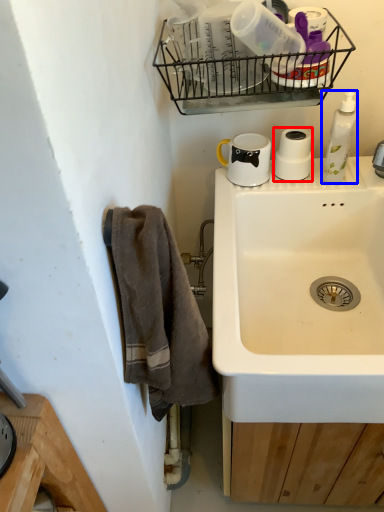
Question: Which object appears closest to the camera in this image, appliance (highlighted by a red box) or cleaning product (highlighted by a blue box)?

Choices:
 (A) appliance
 (B) cleaning product

Answer: (B)